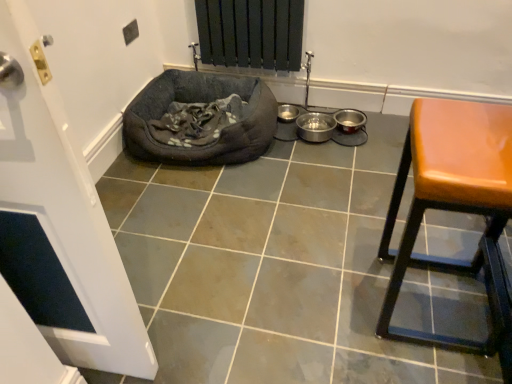
Locate an element on the screen. free spot to the left of leatherette stool at right is located at coordinates (326, 305).